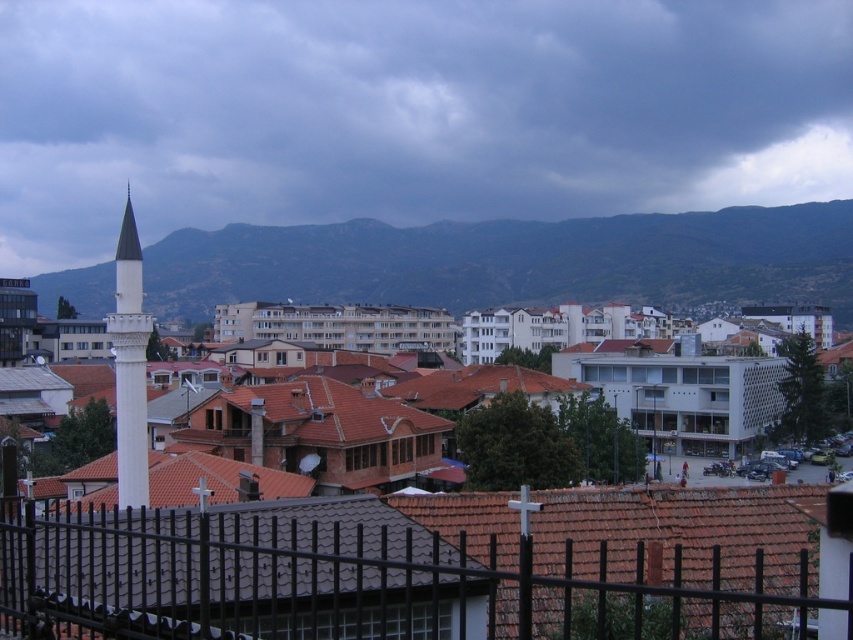
You are standing in front of the cityscape scene. You want to take a photo that includes both the black metal fence at lower center and the brown tile roof at center. Which object should you adjust your camera angle to focus on first to ensure both are in frame?

You should focus on the brown tile roof at center first because the black metal fence at lower center is closer to the viewer, so adjusting for the farther object ensures both are in frame.

You are a city planner assessing the layout of this area. You need to determine if the black metal fence at lower center can be replaced with a wider decorative fence without affecting the visibility of the brown tile roof at center. Based on the current spatial relationship between them, what would you advise?

The black metal fence at lower center is currently wider than the brown tile roof at center. If you replace it with an even wider decorative fence, it might obstruct the view of the brown tile roof at center. Therefore, it is advisable to choose a fence that is narrower or of similar width to maintain visibility.

You are a drone operator who needs to fly a drone from the dark gray cloud at upper center to the brown tile roof at center. What is the approximate distance you need to cover?

The dark gray cloud at upper center is 1503.34 feet from the brown tile roof at center, so the drone needs to cover approximately 1503.34 feet.